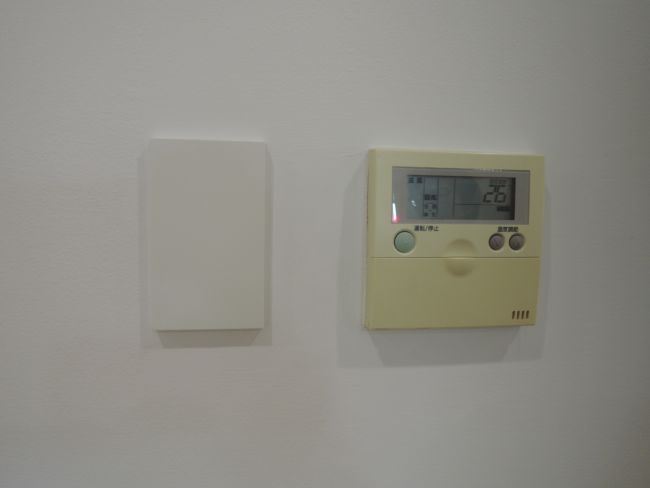
I want to click on lines on the thermostat screen, so click(x=454, y=201), click(x=437, y=185), click(x=422, y=190), click(x=478, y=203).